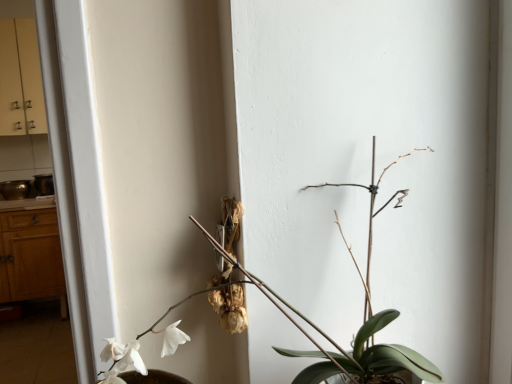
Question: Does wooden dresser at left turn towards green matte plant at center?

Choices:
 (A) no
 (B) yes

Answer: (B)

Question: Can you see wooden dresser at left touching green matte plant at center?

Choices:
 (A) yes
 (B) no

Answer: (B)

Question: Does wooden dresser at left have a larger size compared to green matte plant at center?

Choices:
 (A) yes
 (B) no

Answer: (A)

Question: From the image's perspective, would you say wooden dresser at left is positioned over green matte plant at center?

Choices:
 (A) no
 (B) yes

Answer: (A)

Question: Is wooden dresser at left not within green matte plant at center?

Choices:
 (A) no
 (B) yes

Answer: (B)

Question: Is wooden dresser at left behind green matte plant at center?

Choices:
 (A) no
 (B) yes

Answer: (B)

Question: Considering the relative sizes of green matte plant at center and wooden dresser at left in the image provided, is green matte plant at center wider than wooden dresser at left?

Choices:
 (A) yes
 (B) no

Answer: (B)

Question: Is green matte plant at center facing away from wooden dresser at left?

Choices:
 (A) yes
 (B) no

Answer: (A)

Question: Does green matte plant at center have a larger size compared to wooden dresser at left?

Choices:
 (A) no
 (B) yes

Answer: (A)

Question: Is green matte plant at center aimed at wooden dresser at left?

Choices:
 (A) yes
 (B) no

Answer: (B)

Question: From the image's perspective, is green matte plant at center located beneath wooden dresser at left?

Choices:
 (A) no
 (B) yes

Answer: (A)

Question: From the image's perspective, is green matte plant at center on top of wooden dresser at left?

Choices:
 (A) no
 (B) yes

Answer: (B)

Question: Does wooden counter top at left touch wooden dresser at left?

Choices:
 (A) no
 (B) yes

Answer: (A)